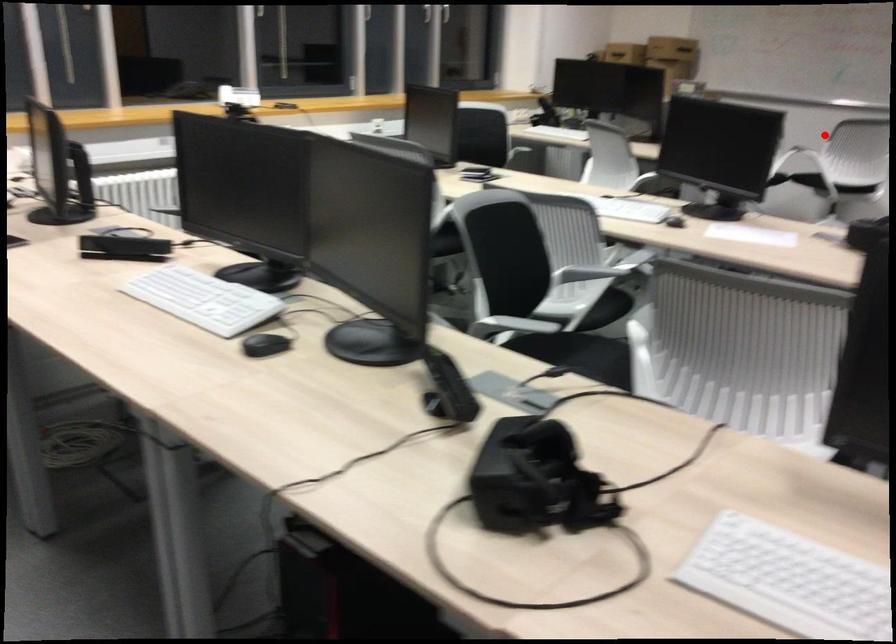
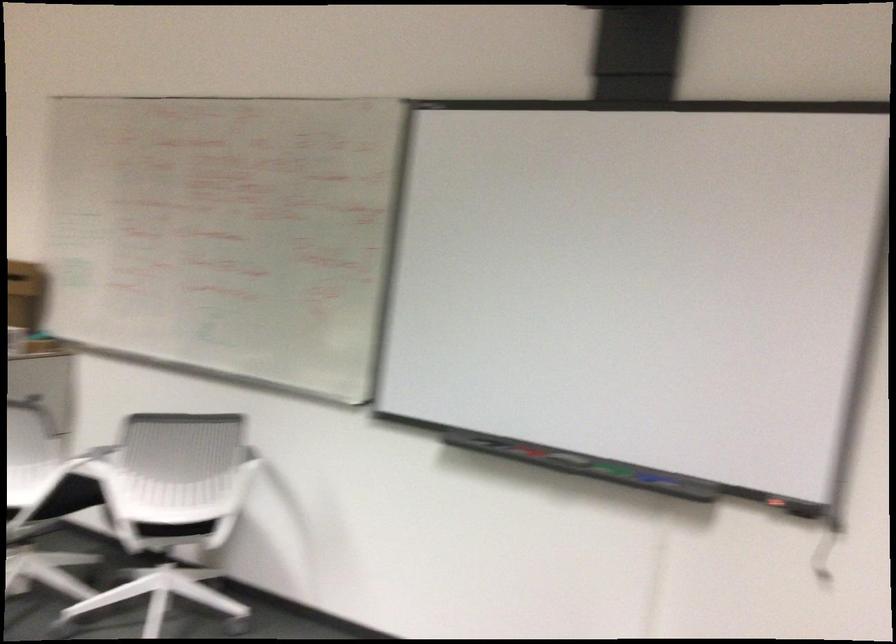
Question: I am providing you with two images of the same scene from different viewpoints. Image1 has a red point marked. In image2, the corresponding 3D location appears at what relative position? Reply with the corresponding letter.

Choices:
 (A) Closer
 (B) Farther

Answer: (A)